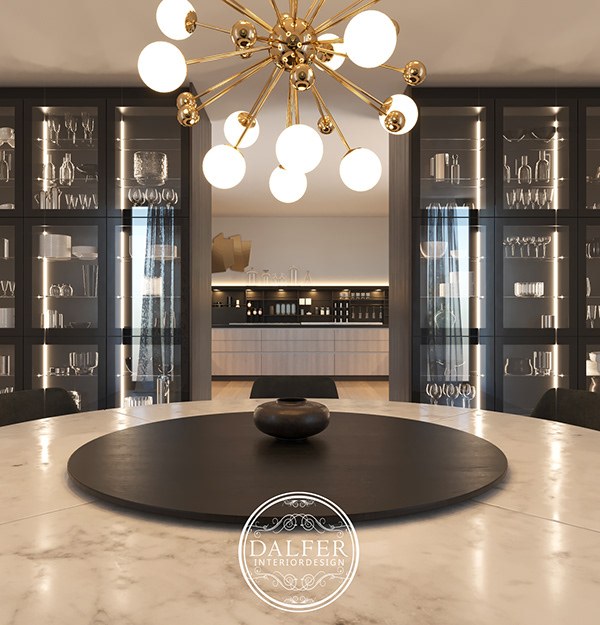
Locate an element on the screen. Image resolution: width=600 pixels, height=625 pixels. entryway is located at coordinates (234, 372).